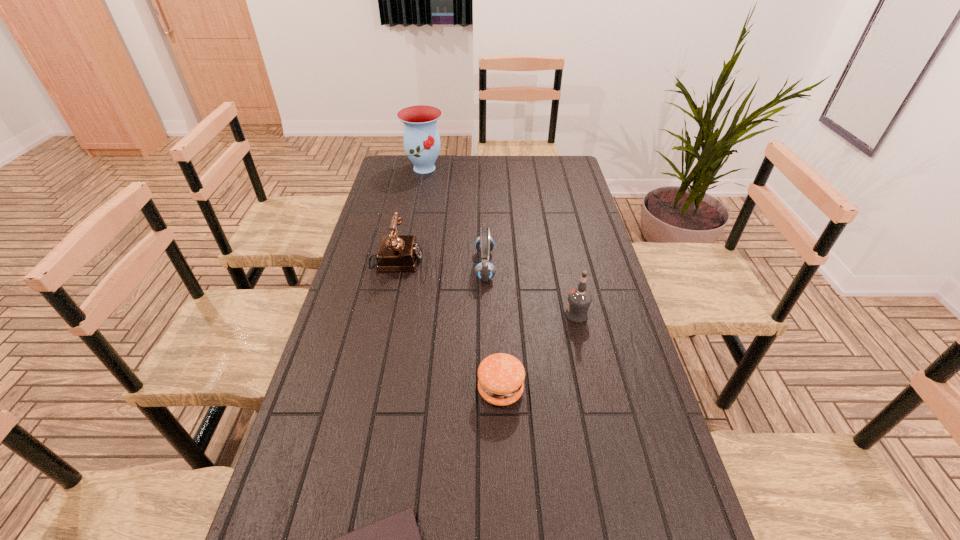
You are a GUI agent. You are given a task and a screenshot of the screen. Output one action in this format:
    pyautogui.click(x=<x>, y=<y>)
    Task: Click on the free spot between the telephone and the rightmost object
    The image size is (960, 540).
    Given the screenshot: What is the action you would take?
    pyautogui.click(x=486, y=289)

In order to click on free space between the tallest object and the headset in this screenshot , I will do `click(455, 217)`.

At what (x,y) coordinates should I click in order to perform the action: click on vacant space that is in between the patty and the fourth farthest object. Please return your answer as a coordinate pair (x, y). This screenshot has height=540, width=960. Looking at the image, I should click on (539, 353).

Where is `vacant area that lies between the patty and the telephone`? Image resolution: width=960 pixels, height=540 pixels. vacant area that lies between the patty and the telephone is located at coordinates pyautogui.click(x=448, y=326).

The height and width of the screenshot is (540, 960). In order to click on free spot between the telephone and the rightmost object in this screenshot , I will do `click(486, 289)`.

Where is `object that is the third closest to the telephone`? The image size is (960, 540). object that is the third closest to the telephone is located at coordinates (579, 299).

Identify the location of object that can be found as the third closest to the second shortest object. (485, 271).

I want to click on free spot that satisfies the following two spatial constraints: 1. on the front label of the vodka; 2. on the front side of the patty, so click(592, 390).

This screenshot has height=540, width=960. In order to click on free spot that satisfies the following two spatial constraints: 1. on the ear cups of the patty; 2. on the left side of the headset in this screenshot , I will do `click(487, 390)`.

This screenshot has height=540, width=960. In order to click on free location that satisfies the following two spatial constraints: 1. on the front label of the rightmost object; 2. on the front side of the fifth tallest object in this screenshot , I will do `click(592, 390)`.